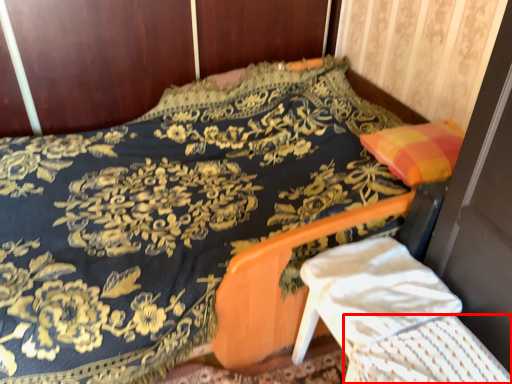
Question: From the image's perspective, where is blanket (annotated by the red box) located relative to armchair?

Choices:
 (A) above
 (B) below

Answer: (B)